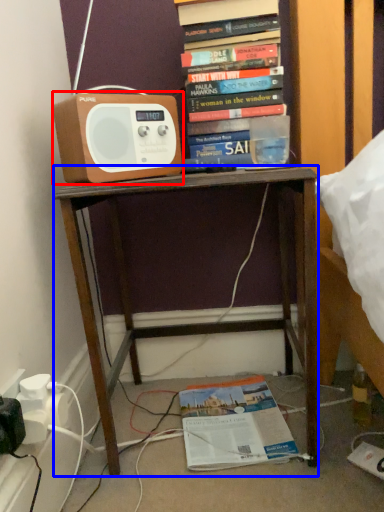
Question: Which object appears closest to the camera in this image, speaker (highlighted by a red box) or desk (highlighted by a blue box)?

Choices:
 (A) speaker
 (B) desk

Answer: (B)